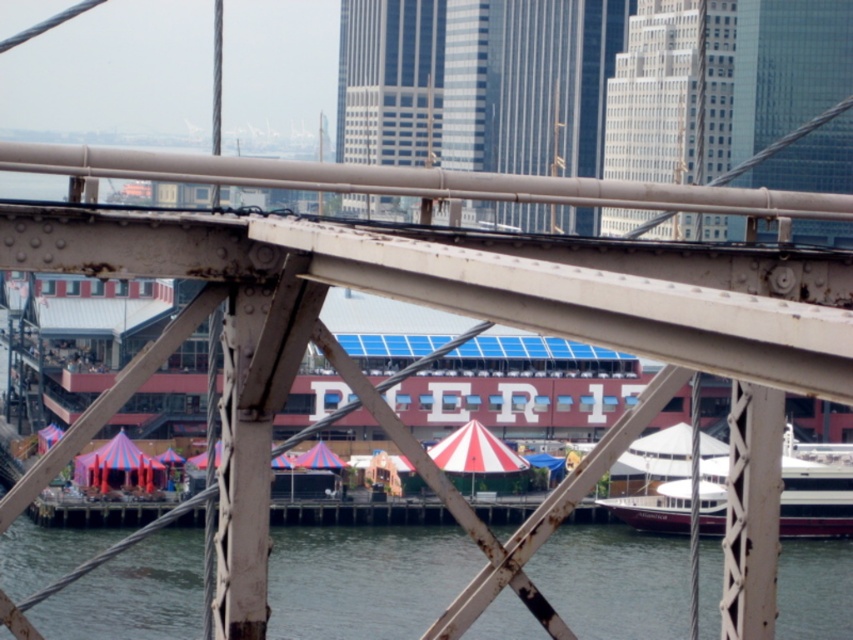
Question: Which point is farther from the camera taking this photo?

Choices:
 (A) (846, 566)
 (B) (844, 516)

Answer: (B)

Question: Is clear water at lower center positioned behind white glossy boat at lower right?

Choices:
 (A) no
 (B) yes

Answer: (B)

Question: Which point is farther to the camera?

Choices:
 (A) (683, 534)
 (B) (277, 561)

Answer: (A)

Question: Does clear water at lower center appear on the right side of white glossy boat at lower right?

Choices:
 (A) no
 (B) yes

Answer: (A)

Question: Observing the image, what is the correct spatial positioning of clear water at lower center in reference to white glossy boat at lower right?

Choices:
 (A) right
 (B) left

Answer: (B)